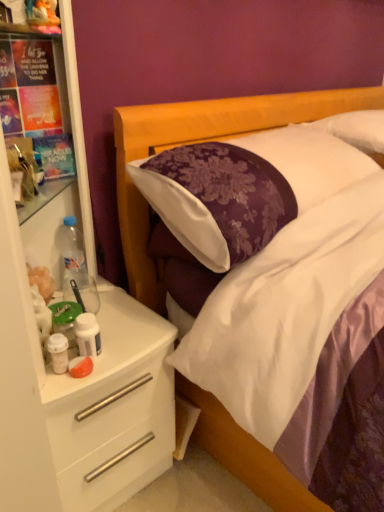
Question: Is white plastic drawer at left in front of or behind plush fabric toy at upper left in the image?

Choices:
 (A) behind
 (B) front

Answer: (B)

Question: From a real-world perspective, is white plastic drawer at left physically located above or below plush fabric toy at upper left?

Choices:
 (A) below
 (B) above

Answer: (A)

Question: Considering the real-world distances, which object is closest to the plush fabric toy at upper left?

Choices:
 (A) white plastic dresser at left
 (B) white plastic drawer at left
 (C) purple satin pillow at center
 (D) clear plastic bottle at left, placed as the second bottle when sorted from front to back
 (E) white glossy bottle at left, placed as the 2th bottle when sorted from left to right

Answer: (D)

Question: Estimate the real-world distances between objects in this image. Which object is closer to the white glossy bottle at left, placed as the 2th bottle when sorted from left to right?

Choices:
 (A) white plastic dresser at left
 (B) purple satin pillow at center
 (C) plush fabric toy at upper left
 (D) clear plastic bottle at left, the first bottle positioned from the back
 (E) white plastic drawer at left

Answer: (A)